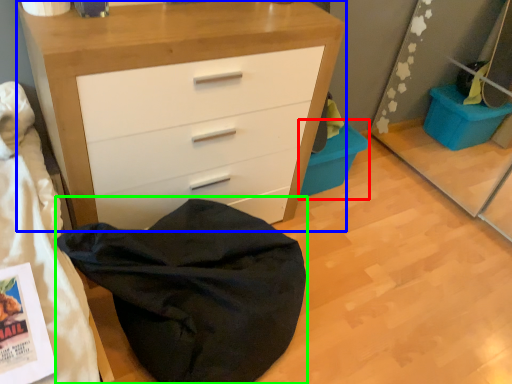
Question: Which object is positioned farthest from cabinetry (highlighted by a red box)? Select from chest of drawers (highlighted by a blue box) and bean bag chair (highlighted by a green box).

Choices:
 (A) chest of drawers
 (B) bean bag chair

Answer: (B)